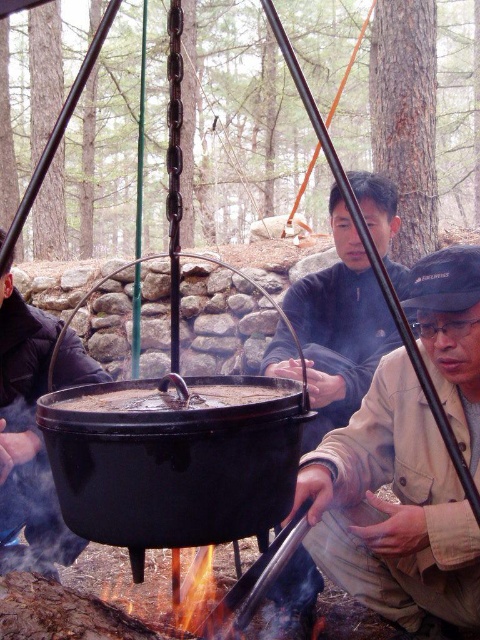
You are a photographer trying to capture the scene of the black matte pot at center and the brown fabric jacket at lower right. To ensure both are in frame, where should you position yourself relative to the tripod structure holding the pot?

You should position yourself to the right side of the tripod structure holding the black matte pot at center so that both the black matte pot at center and the brown fabric jacket at lower right are visible in the frame, as the brown fabric jacket at lower right is on the right side of the pot.

You are standing at the point with coordinates point [40,349] and want to move to the point with coordinates point [257,385]. Given that there is a large black cast iron pot suspended above the fire between them, can you directly walk from your current position to the target point without going around the pot?

Point [40,349] is behind point [257,385], so the pot is blocking the direct path between them. Therefore, you cannot walk directly to the target point without going around the pot.

You are a hiker who needs to choose a jacket to stay warm in cold weather. Based on the image, which jacket would you recommend between the brown fabric jacket at lower right and the dark blue jacket at center?

The dark blue jacket at center is thicker than the brown fabric jacket at lower right, so it would provide better warmth in cold weather.